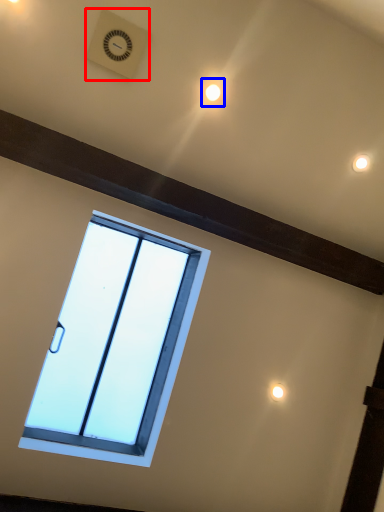
Question: Which object is further to the camera taking this photo, clock (highlighted by a red box) or light (highlighted by a blue box)?

Choices:
 (A) clock
 (B) light

Answer: (B)